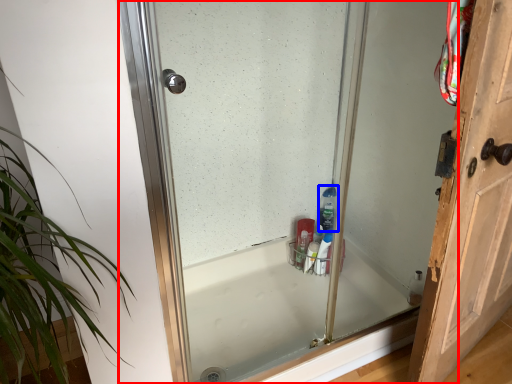
Question: Which of the following is the closest to the observer, glass door (highlighted by a red box) or cleaning product (highlighted by a blue box)?

Choices:
 (A) glass door
 (B) cleaning product

Answer: (A)